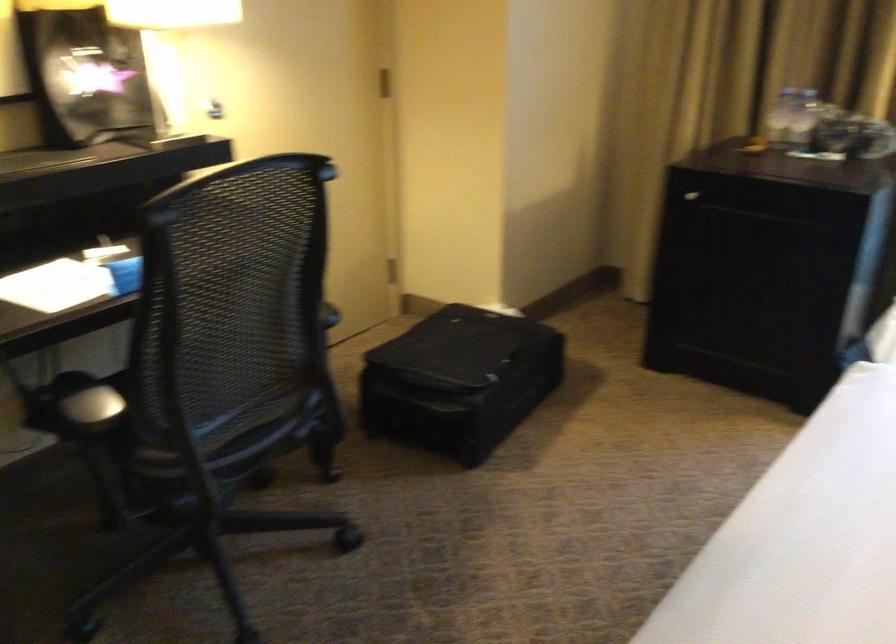
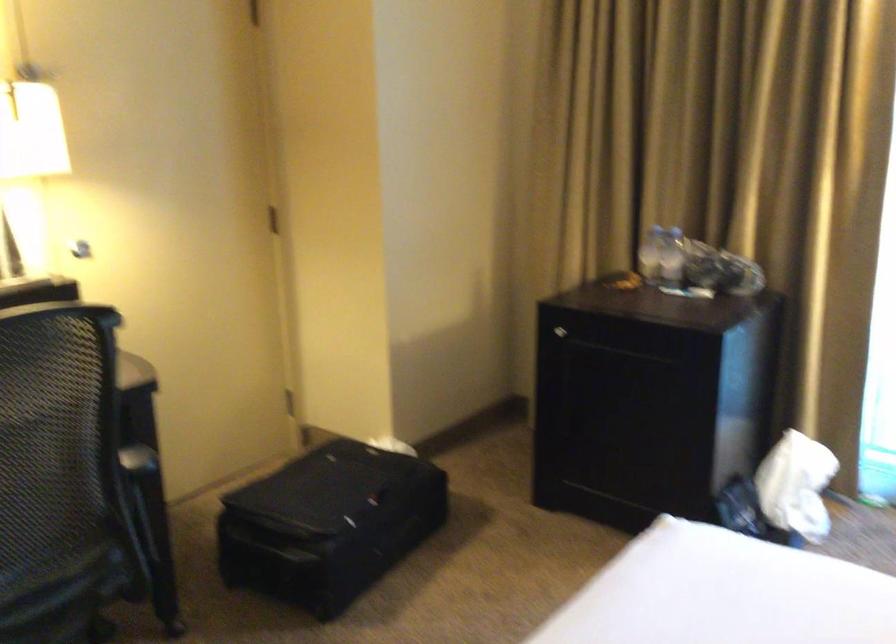
Question: How did the camera likely rotate?

Choices:
 (A) Left
 (B) Right
 (C) Up
 (D) Down

Answer: (C)